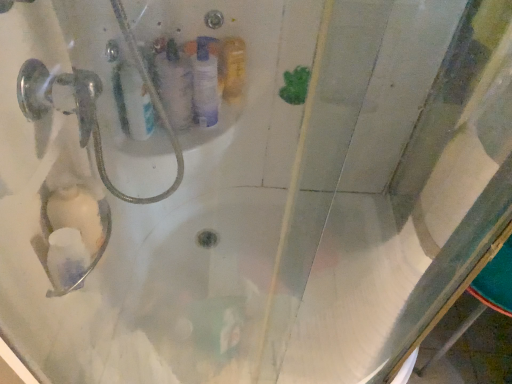
Image resolution: width=512 pixels, height=384 pixels. I want to click on white glossy bath at center, so click(x=13, y=366).

In order to face white glossy bath at center, should I rotate leftwards or rightwards?

Turn right by 8.714 degrees to look at white glossy bath at center.

What do you see at coordinates (13, 366) in the screenshot?
I see `white glossy bath at center` at bounding box center [13, 366].

Identify the location of white glossy bath at center. The width and height of the screenshot is (512, 384). (13, 366).